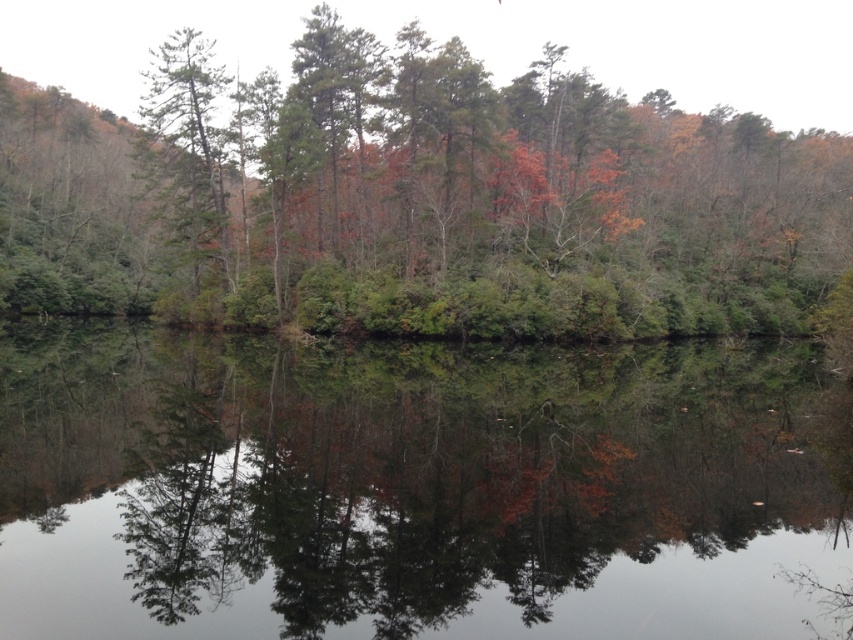
Question: Which point is farther from the camera taking this photo?

Choices:
 (A) (769, 484)
 (B) (380, 291)

Answer: (B)

Question: Does transparent water at center appear on the left side of green matte tree at left?

Choices:
 (A) no
 (B) yes

Answer: (A)

Question: Which of the following is the closest to the observer?

Choices:
 (A) green matte tree at left
 (B) transparent water at center
 (C) green matte tree at center

Answer: (B)

Question: Can you confirm if transparent water at center is positioned below green matte tree at left?

Choices:
 (A) yes
 (B) no

Answer: (A)

Question: Estimate the real-world distances between objects in this image. Which object is farther from the transparent water at center?

Choices:
 (A) green matte tree at left
 (B) green matte tree at center

Answer: (B)

Question: Can you confirm if green matte tree at center is positioned to the right of green matte tree at left?

Choices:
 (A) no
 (B) yes

Answer: (B)